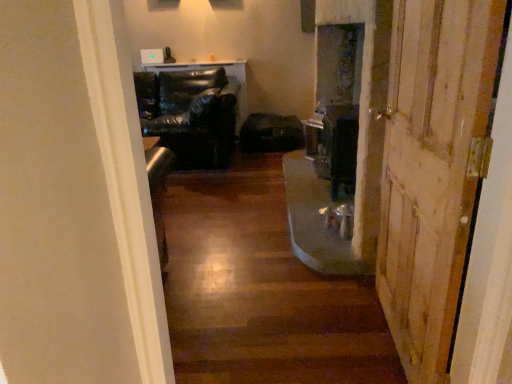
Question: In terms of height, does wooden door at right look taller or shorter compared to wooden floor at center?

Choices:
 (A) tall
 (B) short

Answer: (A)

Question: Considering the positions of wooden door at right and wooden floor at center in the image, is wooden door at right wider or thinner than wooden floor at center?

Choices:
 (A) thin
 (B) wide

Answer: (A)

Question: Estimate the real-world distances between objects in this image. Which object is farther from the wooden door at right?

Choices:
 (A) black leather chair at center
 (B) wooden floor at center

Answer: (A)

Question: Which of these objects is positioned closest to the black leather chair at center?

Choices:
 (A) wooden floor at center
 (B) wooden door at right

Answer: (A)